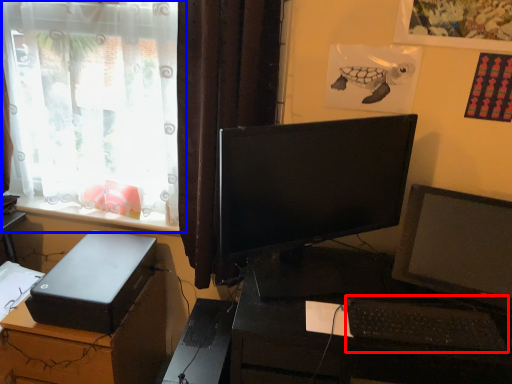
Question: Among these objects, which one is farthest to the camera, computer keyboard (highlighted by a red box) or window (highlighted by a blue box)?

Choices:
 (A) computer keyboard
 (B) window

Answer: (B)